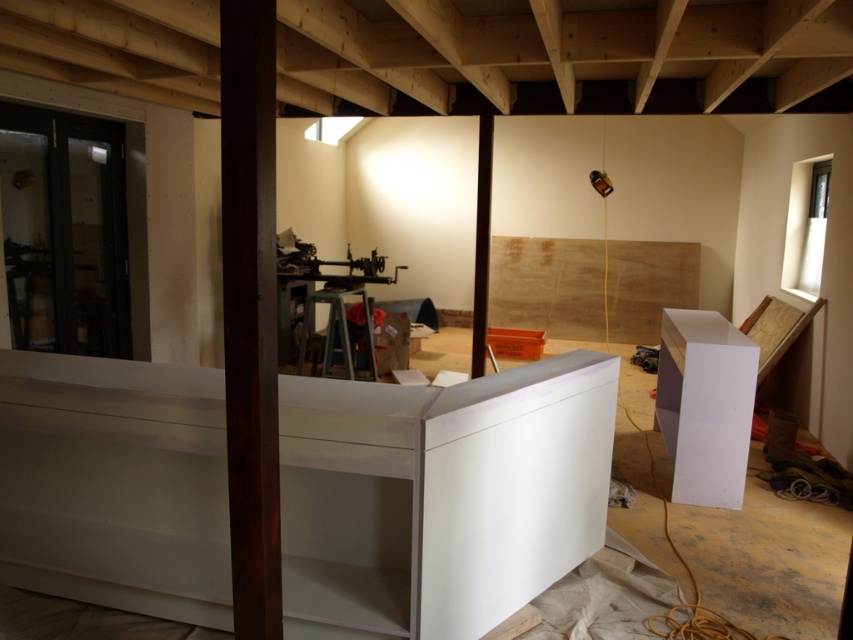
Question: Which point is farther to the camera?

Choices:
 (A) white glossy cabinet at right
 (B) matte black beam at center

Answer: (B)

Question: Can you confirm if dark wood pillar at center is smaller than matte black beam at center?

Choices:
 (A) yes
 (B) no

Answer: (B)

Question: Is dark wood pillar at center further to the viewer compared to matte black beam at center?

Choices:
 (A) yes
 (B) no

Answer: (B)

Question: Considering the real-world distances, which object is farthest from the white glossy cabinet at right?

Choices:
 (A) dark wood pillar at center
 (B) matte black beam at center

Answer: (A)

Question: Which is nearer to the dark wood pillar at center?

Choices:
 (A) matte black beam at center
 (B) white glossy cabinet at right

Answer: (B)

Question: Can you confirm if dark wood pillar at center is smaller than matte black beam at center?

Choices:
 (A) no
 (B) yes

Answer: (A)